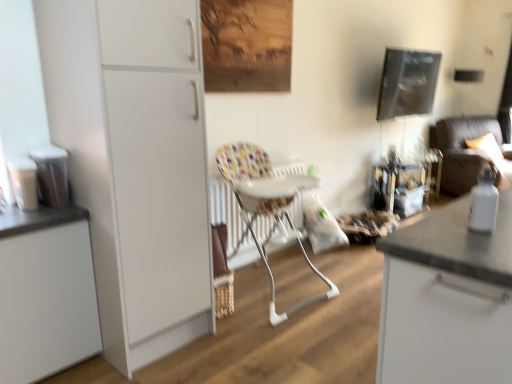
Question: From the image's perspective, is wooden table at right beneath white matte cabinet at left, which is the first cabinetry from left to right?

Choices:
 (A) no
 (B) yes

Answer: (A)

Question: Is white matte cabinet at left, which is the first cabinetry from left to right, a part of wooden table at right?

Choices:
 (A) no
 (B) yes

Answer: (A)

Question: From the image's perspective, is wooden table at right on white matte cabinet at left, which is the first cabinetry from left to right?

Choices:
 (A) yes
 (B) no

Answer: (A)

Question: Can you confirm if wooden table at right is smaller than white matte cabinet at left, which is the first cabinetry from left to right?

Choices:
 (A) yes
 (B) no

Answer: (B)

Question: Does wooden table at right lie in front of white matte cabinet at left, which is the first cabinetry from left to right?

Choices:
 (A) no
 (B) yes

Answer: (A)

Question: Is wooden table at right behind white matte cabinet at left, which is the first cabinetry from left to right?

Choices:
 (A) no
 (B) yes

Answer: (B)

Question: Would you say printed fabric highchair at center is outside white matte cabinet at left, which is the first cabinetry from left to right?

Choices:
 (A) no
 (B) yes

Answer: (B)

Question: From a real-world perspective, is printed fabric highchair at center on white matte cabinet at left, which is the first cabinetry from left to right?

Choices:
 (A) yes
 (B) no

Answer: (A)

Question: Is printed fabric highchair at center taller than white matte cabinet at left, which is the first cabinetry from left to right?

Choices:
 (A) yes
 (B) no

Answer: (A)

Question: From the image's perspective, does printed fabric highchair at center appear higher than white matte cabinet at left, which is the 2th cabinetry from right to left?

Choices:
 (A) no
 (B) yes

Answer: (B)

Question: Is printed fabric highchair at center far away from white matte cabinet at left, which is the 2th cabinetry from right to left?

Choices:
 (A) no
 (B) yes

Answer: (B)

Question: From a real-world perspective, is printed fabric highchair at center beneath white matte cabinet at left, which is the first cabinetry from left to right?

Choices:
 (A) no
 (B) yes

Answer: (A)

Question: Is metallic reflective picture frame at upper right thinner than printed fabric highchair at center?

Choices:
 (A) yes
 (B) no

Answer: (A)